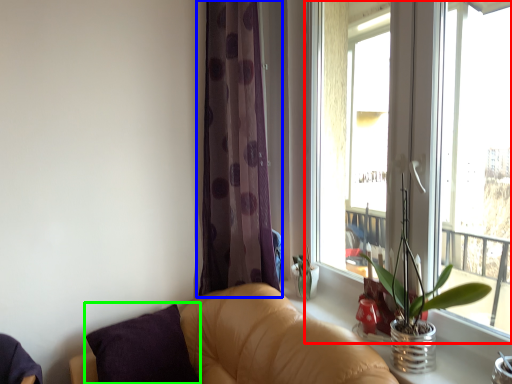
Question: Considering the real-world distances, which object is closest to window (highlighted by a red box)? curtain (highlighted by a blue box) or pillow (highlighted by a green box).

Choices:
 (A) curtain
 (B) pillow

Answer: (A)